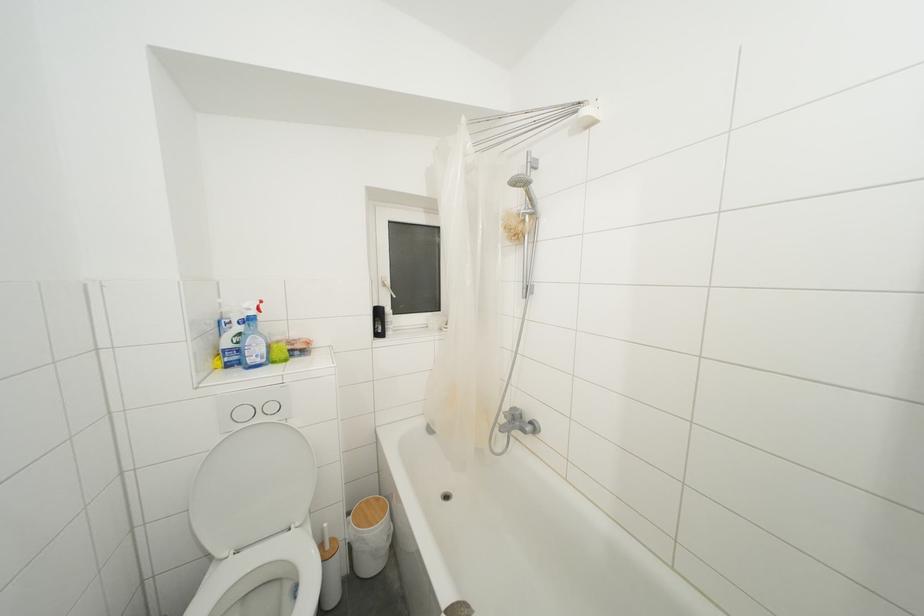
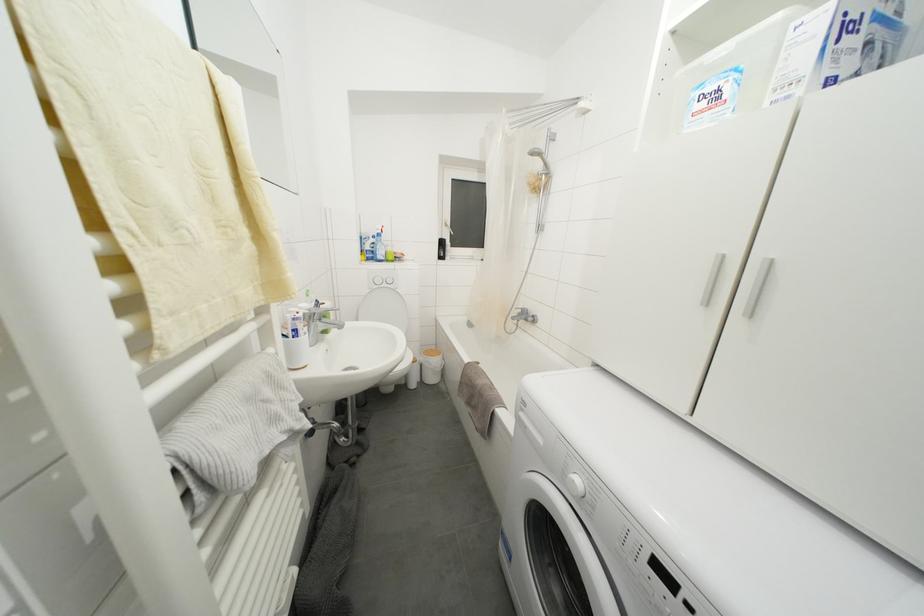
Question: The images are taken continuously from a first-person perspective. In which direction is your viewpoint rotating?

Choices:
 (A) Left
 (B) Right
 (C) Up
 (D) Down

Answer: (A)